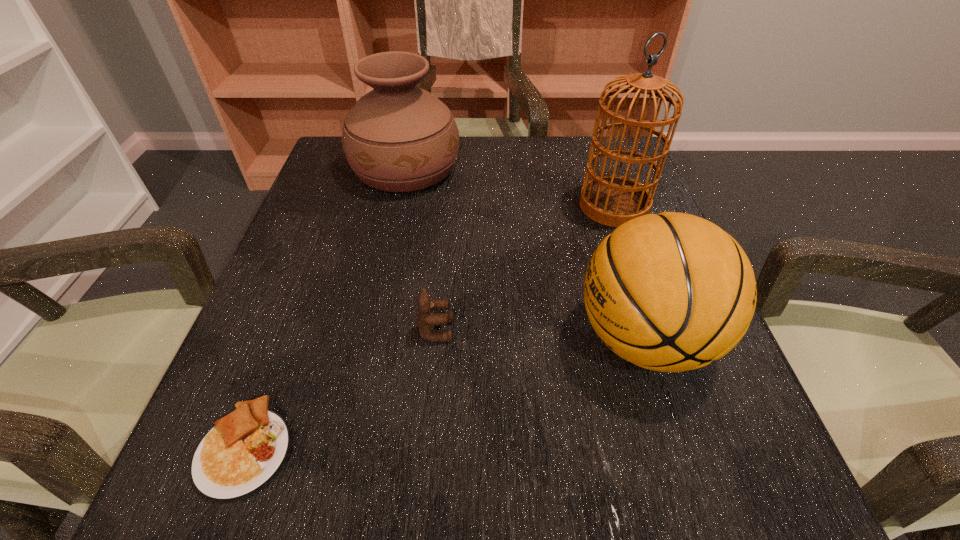
Identify the location of free space that satisfies the following two spatial constraints: 1. on the front side of the tallest object; 2. on the right side of the urn. (397, 206).

Where is `free point that satisfies the following two spatial constraints: 1. on the front side of the birdcage; 2. on the face of the second shortest object`? Image resolution: width=960 pixels, height=540 pixels. free point that satisfies the following two spatial constraints: 1. on the front side of the birdcage; 2. on the face of the second shortest object is located at coordinates (657, 330).

This screenshot has height=540, width=960. I want to click on free region that satisfies the following two spatial constraints: 1. on the surface of the basketball near the brand logo; 2. on the front side of the shortest object, so click(679, 448).

The width and height of the screenshot is (960, 540). In order to click on free space that satisfies the following two spatial constraints: 1. on the front side of the urn; 2. on the right side of the birdcage in this screenshot , I will do `click(397, 206)`.